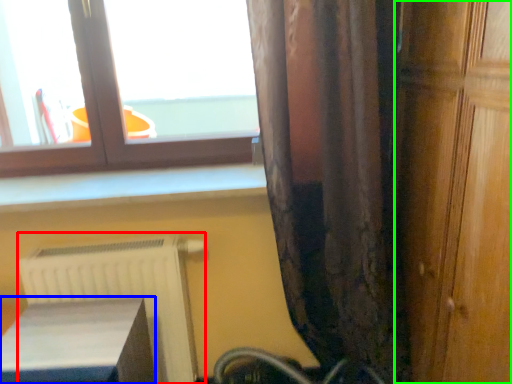
Question: Considering the real-world distances, which object is farthest from radiator (highlighted by a red box)? furniture (highlighted by a blue box) or door (highlighted by a green box)?

Choices:
 (A) furniture
 (B) door

Answer: (B)